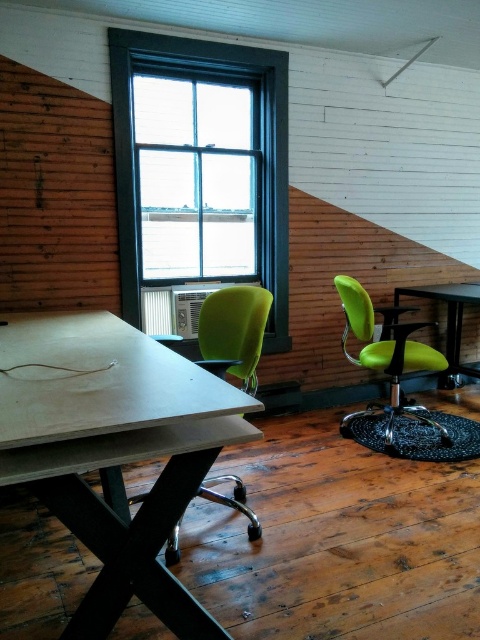
You are sitting in the matte green swivel chair at right and want to reach the matte black table at center. Which direction should you move to get closer to the table?

The matte green swivel chair at right is in front of the matte black table at center, so you should move backward to get closer to the table.

You are arranging chairs for a meeting in the room. You have two tables, the matte white table at center and the matte black table at center. Which table should you choose if you need more space for the chairs around it?

The matte white table at center has a larger width than the matte black table at center, so it provides more space for arranging chairs around it.